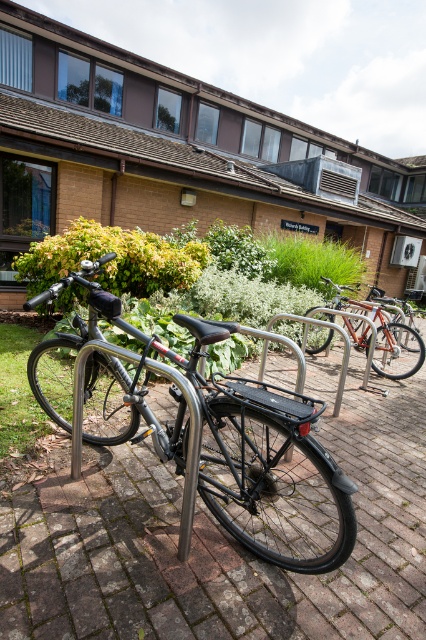
Question: Can you confirm if shiny black bicycle at center is positioned below orange metallic bicycle at center?

Choices:
 (A) yes
 (B) no

Answer: (A)

Question: Which point is closer to the camera taking this photo?

Choices:
 (A) (391, 371)
 (B) (221, 500)

Answer: (B)

Question: Which object appears farthest from the camera in this image?

Choices:
 (A) shiny black bicycle at center
 (B) orange metallic bicycle at center

Answer: (B)

Question: Which object is closer to the camera taking this photo?

Choices:
 (A) orange metallic bicycle at center
 (B) shiny black bicycle at center

Answer: (B)

Question: Can you confirm if shiny black bicycle at center is wider than orange metallic bicycle at center?

Choices:
 (A) no
 (B) yes

Answer: (B)

Question: Is shiny black bicycle at center smaller than orange metallic bicycle at center?

Choices:
 (A) no
 (B) yes

Answer: (A)